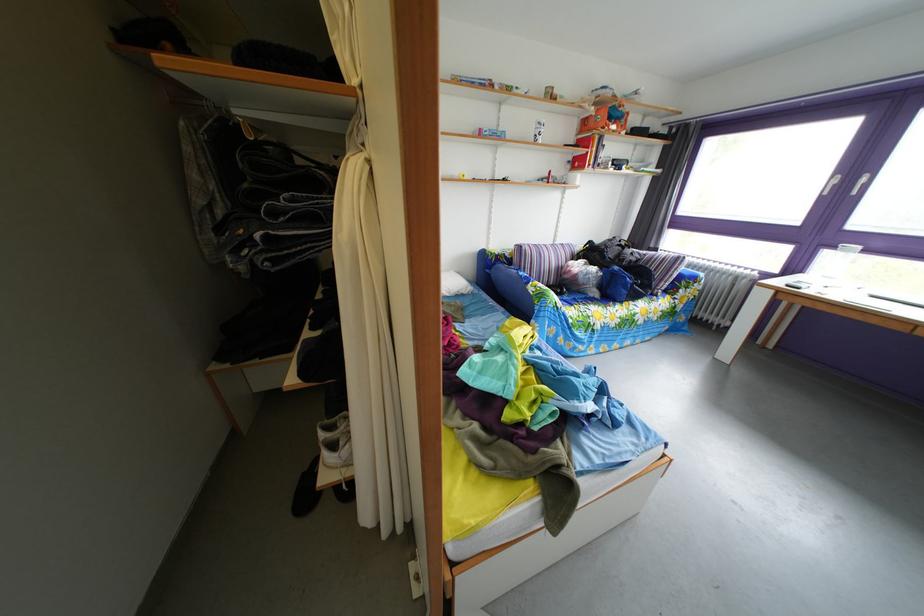
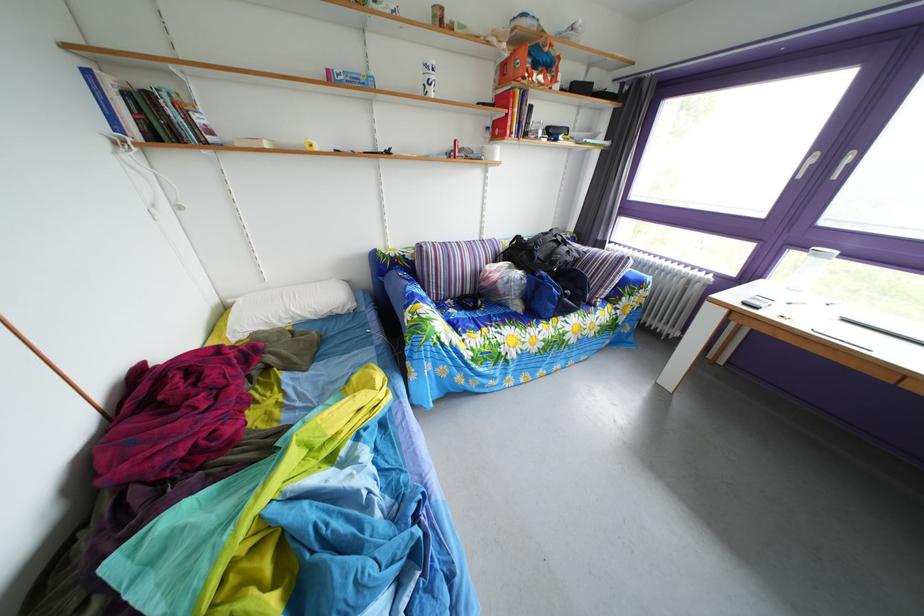
Question: How did the camera likely rotate?

Choices:
 (A) Left
 (B) Right
 (C) Up
 (D) Down

Answer: (D)